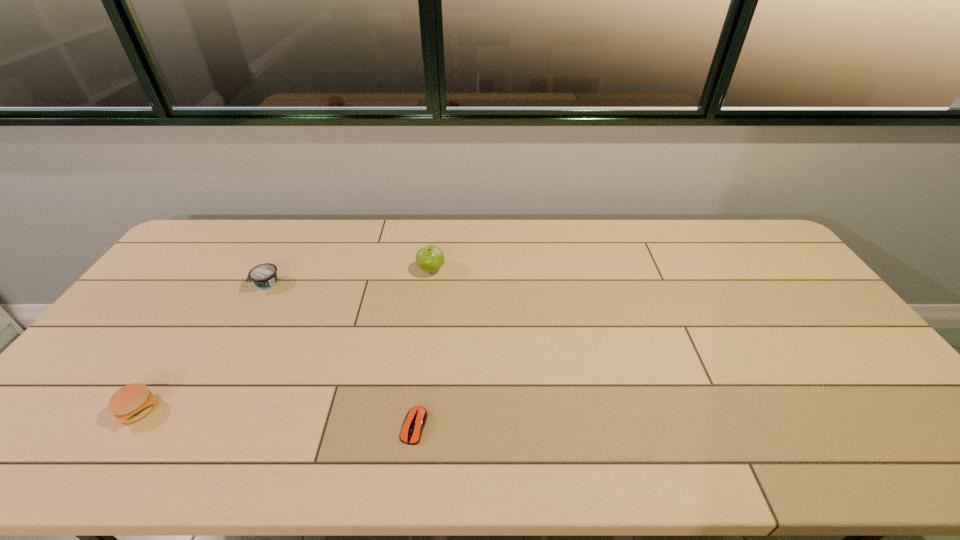
You are a GUI agent. You are given a task and a screenshot of the screen. Output one action in this format:
    pyautogui.click(x=<x>, y=<y>)
    Task: Click on the tallest object
    
    Given the screenshot: What is the action you would take?
    pyautogui.click(x=430, y=258)

Where is `the second tallest object`? The height and width of the screenshot is (540, 960). the second tallest object is located at coordinates (130, 403).

The image size is (960, 540). Find the location of `the leftmost object`. the leftmost object is located at coordinates (130, 403).

I want to click on yogurt, so click(x=264, y=276).

This screenshot has height=540, width=960. Find the location of `the second shortest object`. the second shortest object is located at coordinates (264, 276).

The height and width of the screenshot is (540, 960). I want to click on computer mouse, so click(416, 418).

Locate an element on the screen. vacant space located 0.070m on the back of the tallest object is located at coordinates (434, 248).

Image resolution: width=960 pixels, height=540 pixels. Find the location of `vacant space located on the front of the third shortest object`. vacant space located on the front of the third shortest object is located at coordinates (102, 464).

Locate an element on the screen. The height and width of the screenshot is (540, 960). free spot located 0.280m on the right of the third object from right to left is located at coordinates (368, 284).

Locate an element on the screen. vacant space positioned on the left of the computer mouse is located at coordinates (364, 426).